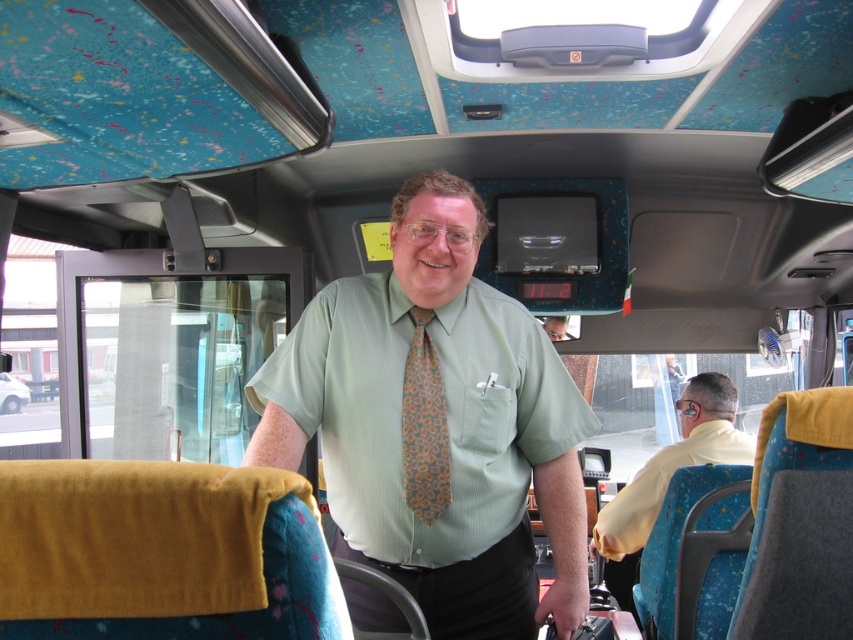
Question: Based on their relative distances, which object is nearer to the yellow shirt at right?

Choices:
 (A) green textured shirt at center
 (B) orange patterned tie at center

Answer: (A)

Question: Among these objects, which one is farthest from the camera?

Choices:
 (A) green textured shirt at center
 (B) orange patterned tie at center
 (C) yellow shirt at right

Answer: (C)

Question: Is green textured shirt at center to the right of yellow shirt at right from the viewer's perspective?

Choices:
 (A) no
 (B) yes

Answer: (A)

Question: In this image, where is green textured shirt at center located relative to yellow shirt at right?

Choices:
 (A) left
 (B) right

Answer: (A)

Question: From the image, what is the correct spatial relationship of yellow shirt at right in relation to orange patterned tie at center?

Choices:
 (A) right
 (B) left

Answer: (A)

Question: Which of the following is the farthest from the observer?

Choices:
 (A) (372, 605)
 (B) (730, 458)
 (C) (412, 465)

Answer: (B)